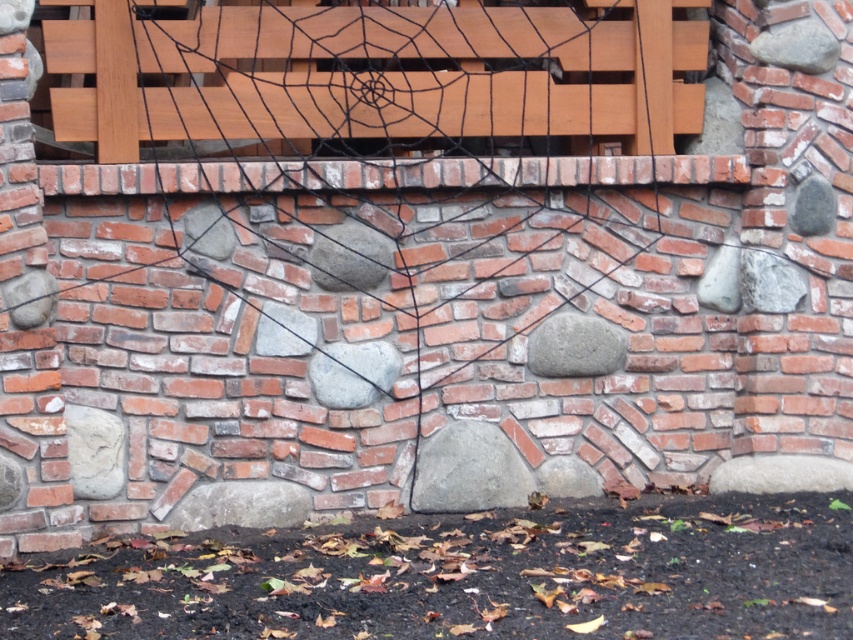
You are planning to hang a large painting that requires 2 meters of vertical space. You see the black netting spider web at center and the matte wooden bench at upper center in the scene. Which object allows enough vertical space for the painting?

The black netting spider web at center has a greater height compared to the matte wooden bench at upper center, so it allows enough vertical space for the painting.

Based on the photo, you are standing in front of a brick wall with a decorative spider web. There is a point marked at coordinates (x=480, y=376) on the wall. If you want to touch this point with a 7.5 meter long stick, will you be able to reach it?

The point at (x=480, y=376) is 8.03 meters away from the camera. Since the stick is only 7.5 meters long, you cannot reach the point with the stick.